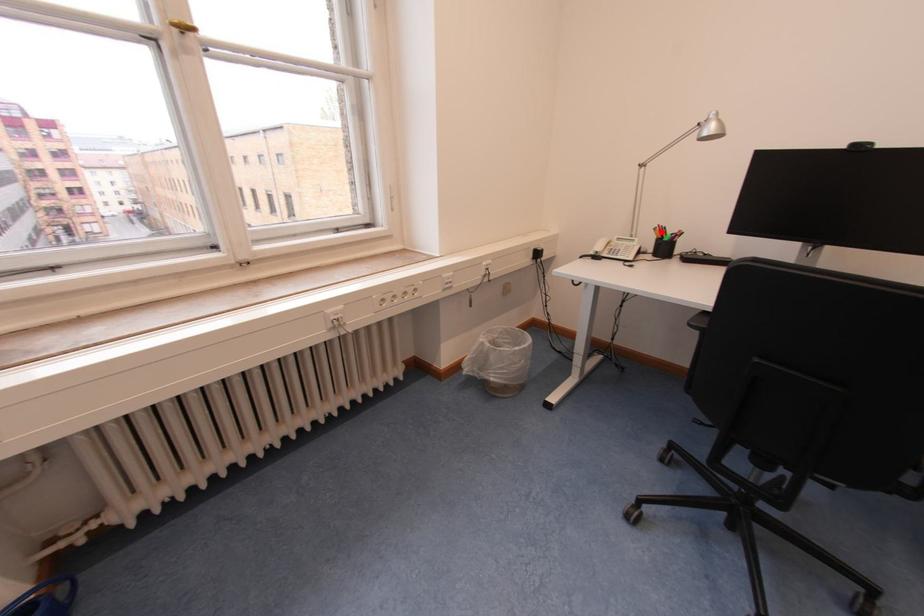
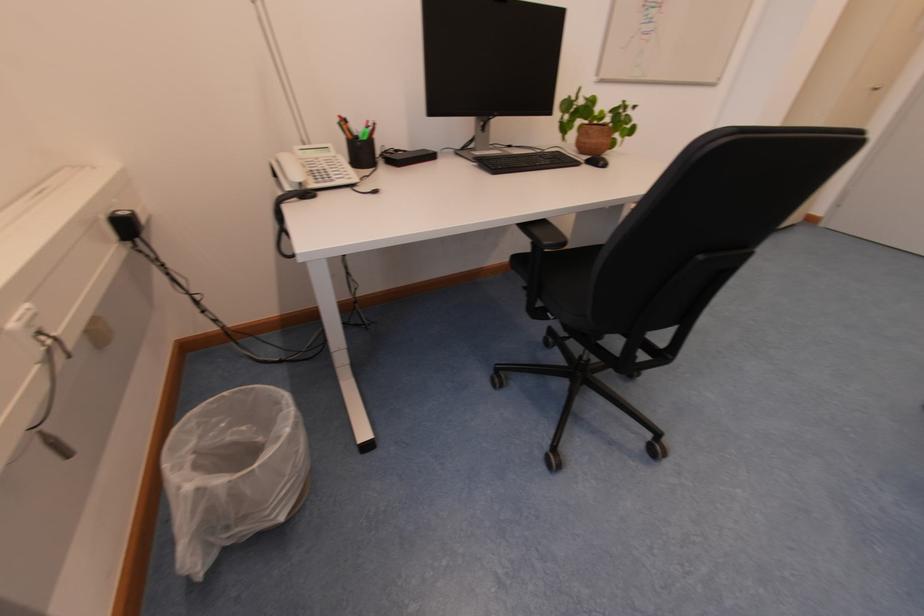
Where in the second image is the point corresponding to the highlighted location from the first image?

(347, 127)